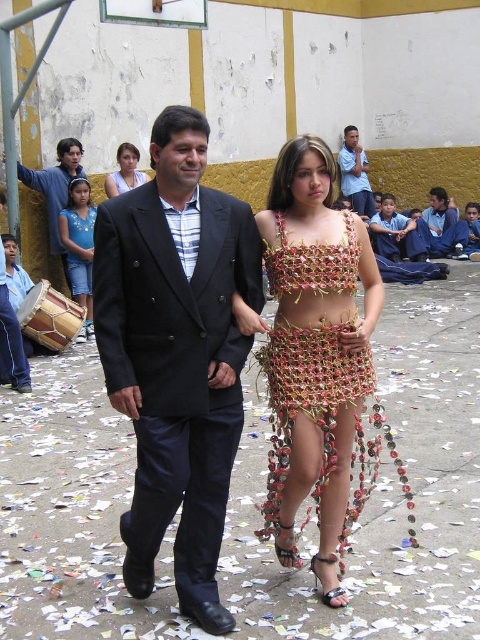
Question: Which point is closer to the camera?

Choices:
 (A) metallic woven dress at center
 (B) matte black suit at upper left
 (C) metallic woven bikini top at center

Answer: (A)

Question: Can you confirm if beaded fabric dress at center is wider than blue fabric drum at left?

Choices:
 (A) no
 (B) yes

Answer: (B)

Question: Is black matte suit at center thinner than blue fabric drum at left?

Choices:
 (A) yes
 (B) no

Answer: (B)

Question: Considering the real-world distances, which object is closest to the blue denim jacket at upper right?

Choices:
 (A) metallic woven dress at center
 (B) blue fabric drum at left
 (C) black matte suit at center
 (D) light blue fabric at upper left

Answer: (D)

Question: Can you confirm if blue fabric drum at left is positioned below blue striped shirt at upper center?

Choices:
 (A) no
 (B) yes

Answer: (B)

Question: Which object is the farthest from the beaded fabric dress at center?

Choices:
 (A) blue denim jacket at upper right
 (B) metallic woven dress at center
 (C) matte black suit at upper left

Answer: (A)